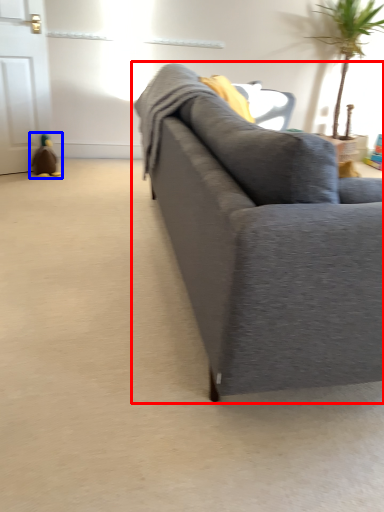
Question: Among these objects, which one is farthest to the camera, studio couch (highlighted by a red box) or toy (highlighted by a blue box)?

Choices:
 (A) studio couch
 (B) toy

Answer: (B)